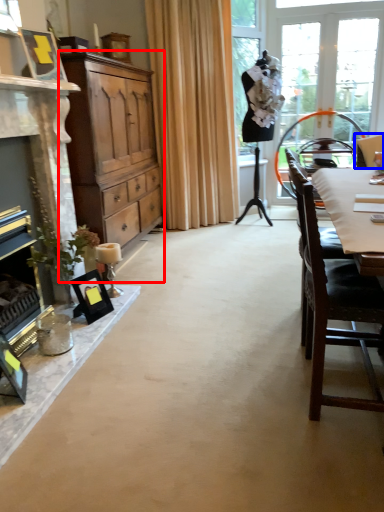
Question: Which of the following is the farthest to the observer, cabinetry (highlighted by a red box) or chair (highlighted by a blue box)?

Choices:
 (A) cabinetry
 (B) chair

Answer: (B)